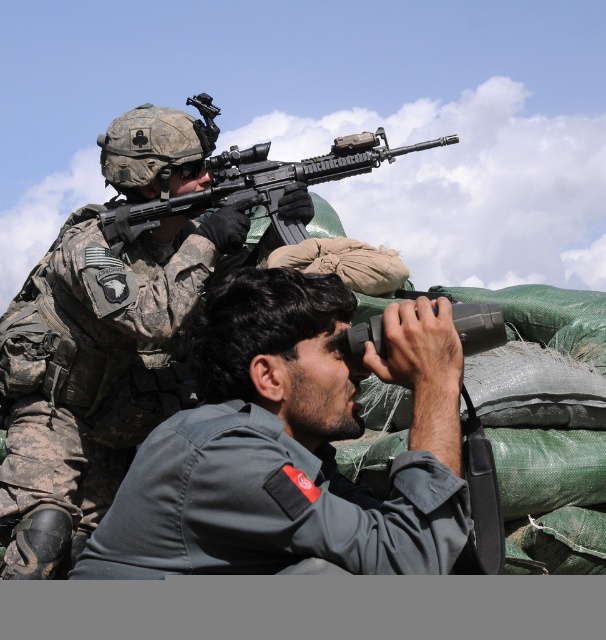
Question: Is matte black rifle at upper center positioned behind black rubber binoculars at center?

Choices:
 (A) no
 (B) yes

Answer: (B)

Question: Is matte black rifle at upper center to the left of black rubber binoculars at center from the viewer's perspective?

Choices:
 (A) yes
 (B) no

Answer: (A)

Question: Among these objects, which one is nearest to the camera?

Choices:
 (A) matte black rifle at upper center
 (B) gray fabric binoculars at center
 (C) black rubber binoculars at center

Answer: (B)

Question: Can you confirm if gray fabric binoculars at center is smaller than black rubber binoculars at center?

Choices:
 (A) no
 (B) yes

Answer: (A)

Question: Which point appears farthest from the camera in this image?

Choices:
 (A) (371, 337)
 (B) (159, 531)

Answer: (A)

Question: Which object is positioned farthest from the matte black rifle at upper center?

Choices:
 (A) black rubber binoculars at center
 (B) gray fabric binoculars at center

Answer: (B)